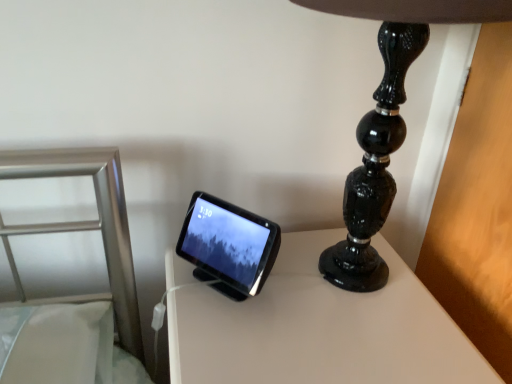
This screenshot has height=384, width=512. In order to click on vacant region to the right of matte black tablet at center in this screenshot , I will do `click(320, 282)`.